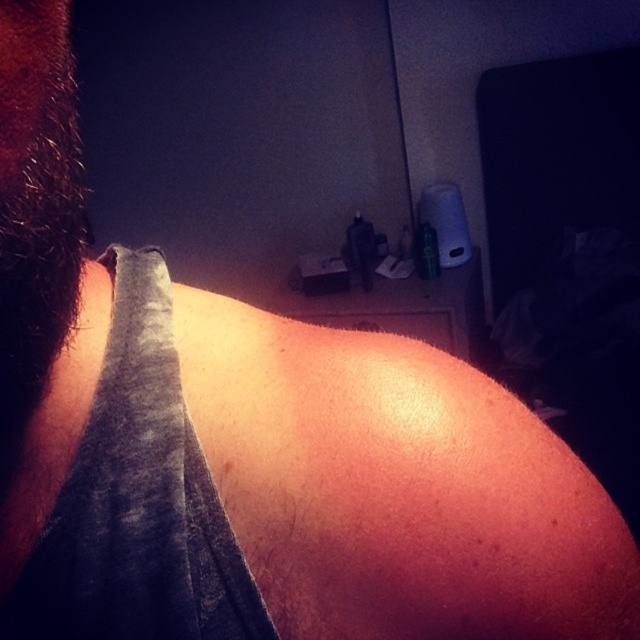
You are holding a 12 inch ruler and want to measure the distance between you and the point at coordinates point (189, 557). Can you reach it without moving your hand?

The distance between you and the point (189, 557) is 13.65 inches, which is longer than your 12 inch ruler. Therefore, you cannot reach it without extending your hand further.

You are a fashion designer observing the image. You need to determine the position of the gray cotton shirt at left relative to the hairy skin at left. Which one is lower in the image?

The gray cotton shirt at left is located below hairy skin at left, so the gray cotton shirt at left is lower in the image.

You are a fashion designer observing the image. You need to determine which item is more suitable for a winter collection between the gray cotton shirt at left and the hairy skin at left. Based on their sizes, which one would you choose?

The gray cotton shirt at left has a larger size compared to hairy skin at left, so it would be more suitable for a winter collection as larger garments are typically preferred for warmth and coverage.